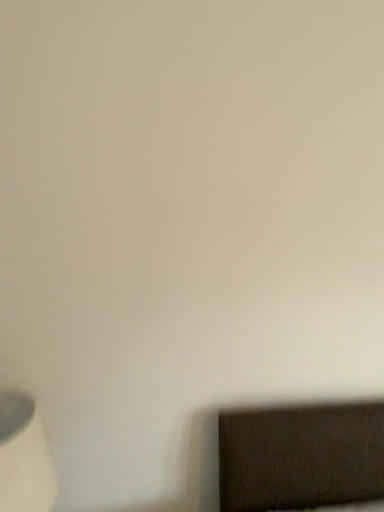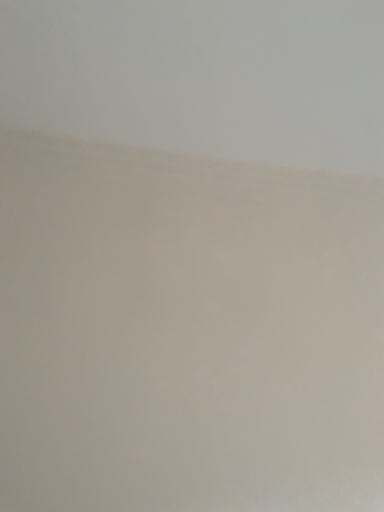
Question: How did the camera likely rotate when shooting the video?

Choices:
 (A) rotated downward
 (B) rotated upward

Answer: (B)